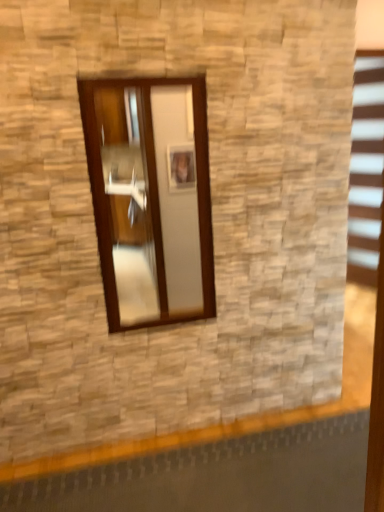
Question: Should I look upward or downward to see wooden-framed mirror at center?

Choices:
 (A) up
 (B) down

Answer: (A)